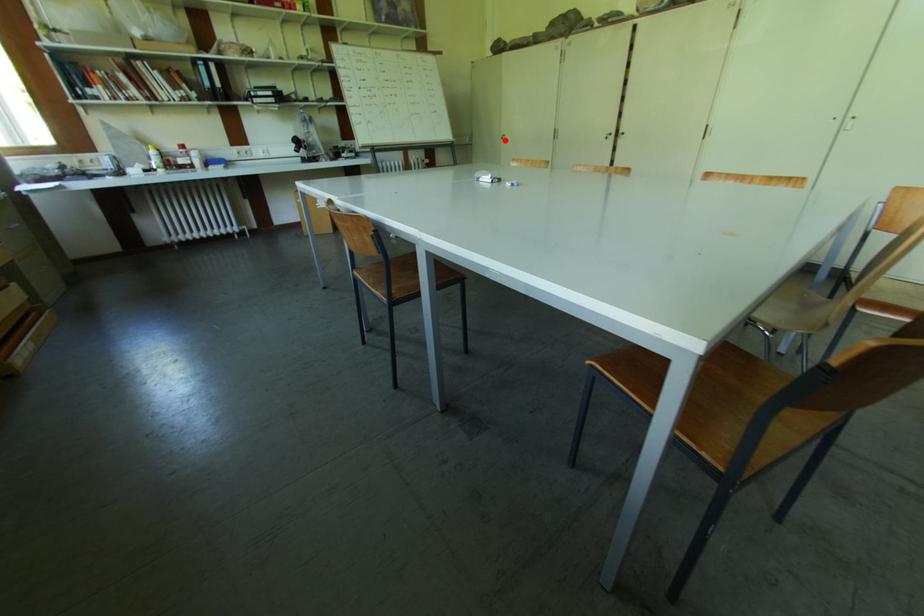
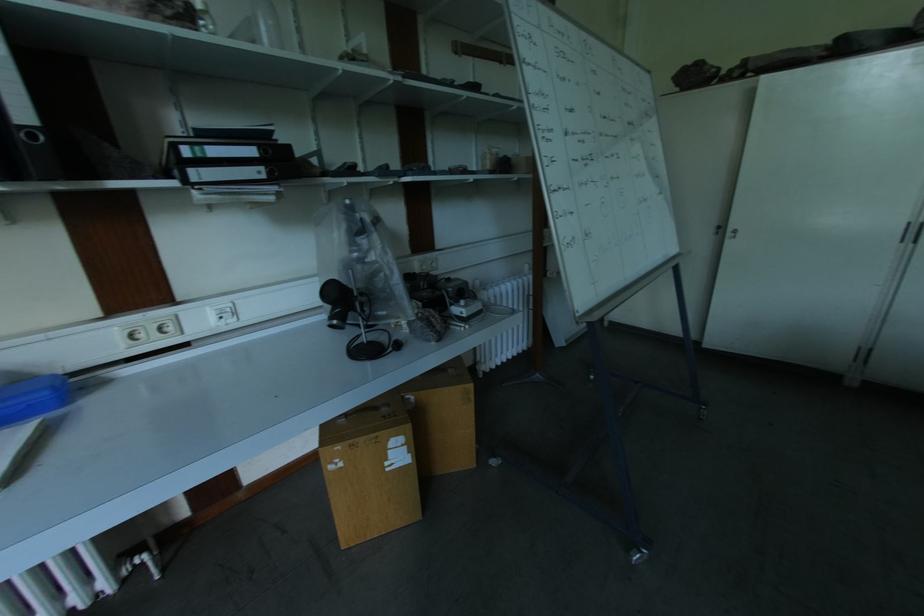
Locate, in the second image, the point that corresponds to the highlighted location in the first image.

(737, 238)